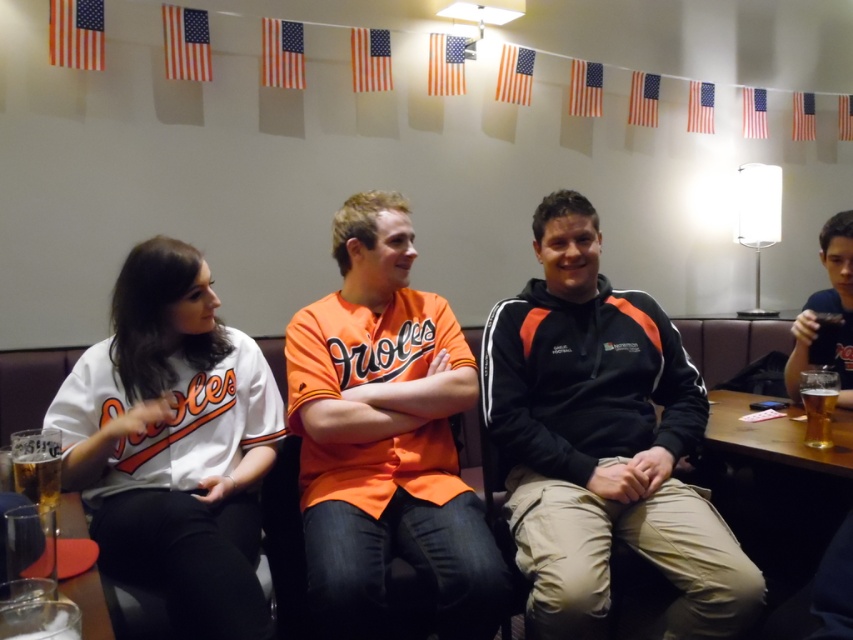
Question: Can you confirm if black fleece jacket at center is positioned above translucent glass beer at lower left?

Choices:
 (A) no
 (B) yes

Answer: (B)

Question: Does orange jersey at center have a larger size compared to translucent glass beer at right?

Choices:
 (A) no
 (B) yes

Answer: (B)

Question: Estimate the real-world distances between objects in this image. Which object is closer to the black fleece jacket at center?

Choices:
 (A) translucent glass beer at right
 (B) white jersey at left
 (C) matte black hoodie at center
 (D) orange jersey at center

Answer: (B)

Question: Which point is farther from the camera taking this photo?

Choices:
 (A) (339, 360)
 (B) (814, 323)
 (C) (582, 481)

Answer: (B)

Question: Does orange jersey at center appear under translucent glass beer at right?

Choices:
 (A) yes
 (B) no

Answer: (B)

Question: Which point is closer to the camera?

Choices:
 (A) matte black hoodie at center
 (B) translucent glass beer at lower left
 (C) black fleece jacket at center

Answer: (B)